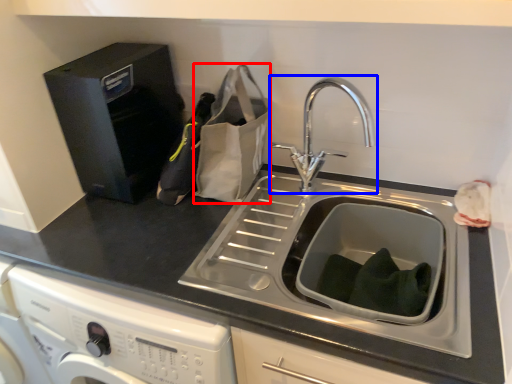
Question: Which object is closer to the camera taking this photo, paper bag (highlighted by a red box) or tap (highlighted by a blue box)?

Choices:
 (A) paper bag
 (B) tap

Answer: (B)